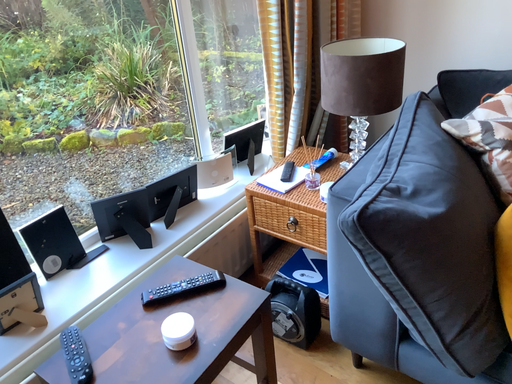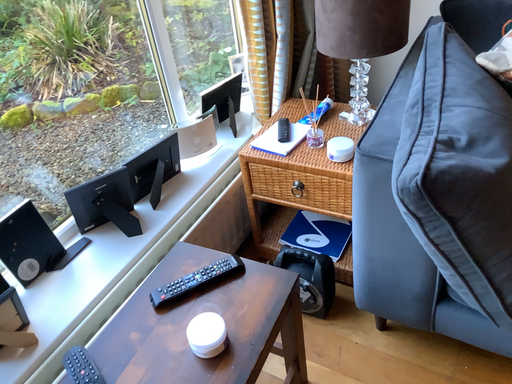
Question: Which way did the camera rotate in the video?

Choices:
 (A) rotated right
 (B) rotated left

Answer: (A)